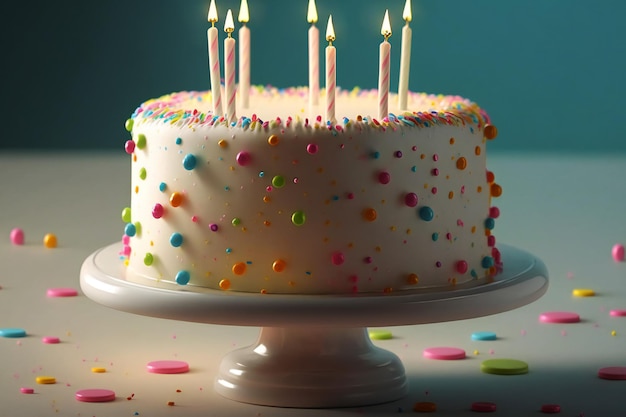
Identify the location of candle wicks. (213, 22), (228, 32), (240, 23), (312, 23), (327, 42), (387, 34), (404, 17).